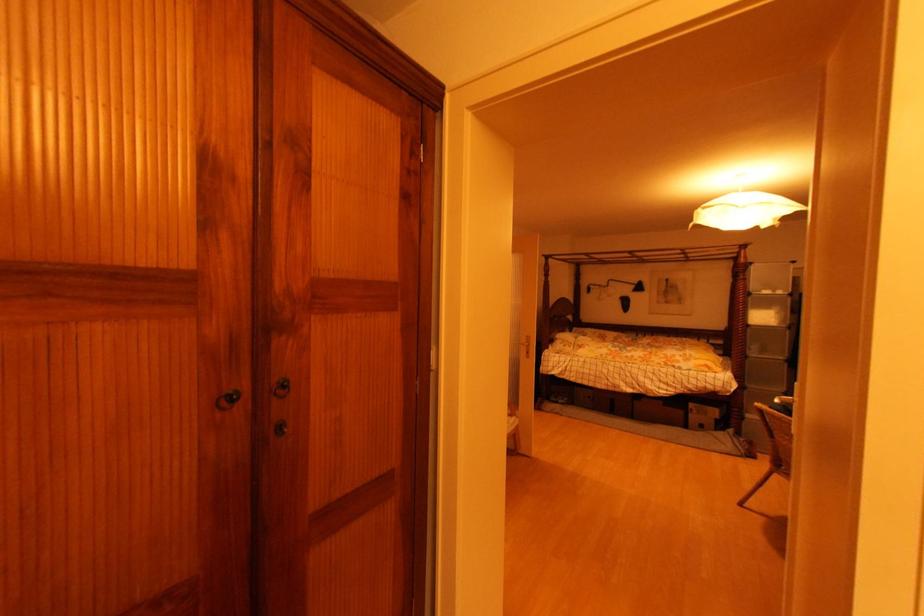
This screenshot has width=924, height=616. Find the location of `white storage bin`. white storage bin is located at coordinates (768, 302).